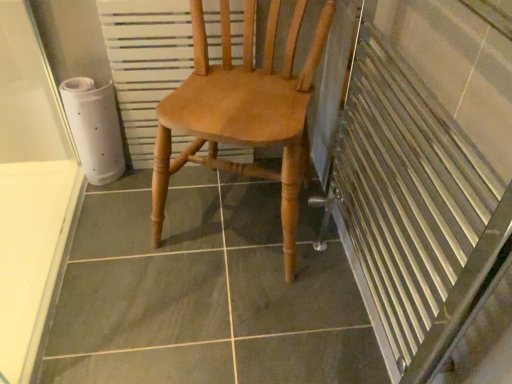
Describe the element at coordinates (243, 112) in the screenshot. I see `light brown wood chair at center` at that location.

The image size is (512, 384). Find the location of `light brown wood chair at center`. light brown wood chair at center is located at coordinates (243, 112).

In order to face light brown wood chair at center, should I rotate leftwards or rightwards?

Turn left by 1.255 degrees to look at light brown wood chair at center.

What do you see at coordinates (146, 62) in the screenshot? I see `white textured radiator at center` at bounding box center [146, 62].

Where is `white textured radiator at center`? The width and height of the screenshot is (512, 384). white textured radiator at center is located at coordinates [x=146, y=62].

What are the coordinates of `light brown wood chair at center` in the screenshot? It's located at (243, 112).

Which object is positioned more to the left, white textured radiator at center or light brown wood chair at center?

white textured radiator at center is more to the left.

Between white textured radiator at center and light brown wood chair at center, which one is positioned in front?

light brown wood chair at center.

Does point (175, 61) lie in front of point (294, 125)?

No, it is not.

From the image's perspective, is white textured radiator at center above light brown wood chair at center?

Yes, from the image's perspective, white textured radiator at center is on top of light brown wood chair at center.

From a real-world perspective, is white textured radiator at center positioned above or below light brown wood chair at center?

From a real-world perspective, white textured radiator at center is physically below light brown wood chair at center.

Does white textured radiator at center have a greater width compared to light brown wood chair at center?

In fact, white textured radiator at center might be narrower than light brown wood chair at center.

In terms of height, does white textured radiator at center look taller or shorter compared to light brown wood chair at center?

Considering their sizes, white textured radiator at center has less height than light brown wood chair at center.

Which of these two, white textured radiator at center or light brown wood chair at center, is bigger?

light brown wood chair at center.

Which is correct: white textured radiator at center is inside light brown wood chair at center, or outside of it?

white textured radiator at center exists entirely within light brown wood chair at center.

Would you consider white textured radiator at center to be distant from light brown wood chair at center?

They are positioned close to each other.

Looking at this image, could you tell me if white textured radiator at center is facing light brown wood chair at center?

Yes.

What's the angular difference between white textured radiator at center and light brown wood chair at center's facing directions?

white textured radiator at center and light brown wood chair at center are facing 19.9 degrees away from each other.

In the image, there is a light brown wood chair at center. Identify the location of radiator below it (from a real-world perspective). Image resolution: width=512 pixels, height=384 pixels. (146, 62).

In the image, is light brown wood chair at center on the left side or the right side of white textured radiator at center?

Clearly, light brown wood chair at center is on the right of white textured radiator at center in the image.

Is light brown wood chair at center in front of or behind white textured radiator at center in the image?

In the image, light brown wood chair at center appears in front of white textured radiator at center.

Is point (213, 154) behind point (110, 14)?

No, it is in front of (110, 14).

From the image's perspective, would you say light brown wood chair at center is shown under white textured radiator at center?

Yes, from the image's perspective, light brown wood chair at center is beneath white textured radiator at center.

From a real-world perspective, is light brown wood chair at center located higher than white textured radiator at center?

Correct, in the physical world, light brown wood chair at center is higher than white textured radiator at center.

Considering the relative sizes of light brown wood chair at center and white textured radiator at center in the image provided, is light brown wood chair at center wider than white textured radiator at center?

Yes.

From the picture: Considering the relative sizes of light brown wood chair at center and white textured radiator at center in the image provided, is light brown wood chair at center shorter than white textured radiator at center?

Incorrect, the height of light brown wood chair at center does not fall short of that of white textured radiator at center.

Is light brown wood chair at center bigger or smaller than white textured radiator at center?

Considering their sizes, light brown wood chair at center takes up more space than white textured radiator at center.

Would you say light brown wood chair at center is inside or outside white textured radiator at center?

light brown wood chair at center lies outside white textured radiator at center.

Is light brown wood chair at center positioned far away from white textured radiator at center?

No.

Is light brown wood chair at center oriented towards white textured radiator at center?

No, light brown wood chair at center is not turned towards white textured radiator at center.

How much distance is there between light brown wood chair at center and white textured radiator at center?

light brown wood chair at center is 8.27 inches from white textured radiator at center.

You are a GUI agent. You are given a task and a screenshot of the screen. Output one action in this format:
    pyautogui.click(x=<x>, y=<y>)
    Task: Click on the chair in front of the white textured radiator at center
    Image resolution: width=512 pixels, height=384 pixels.
    Given the screenshot: What is the action you would take?
    pyautogui.click(x=243, y=112)

Where is `chair on the right of white textured radiator at center`? chair on the right of white textured radiator at center is located at coordinates (243, 112).

What are the coordinates of `radiator below the light brown wood chair at center (from a real-world perspective)` in the screenshot? It's located at (146, 62).